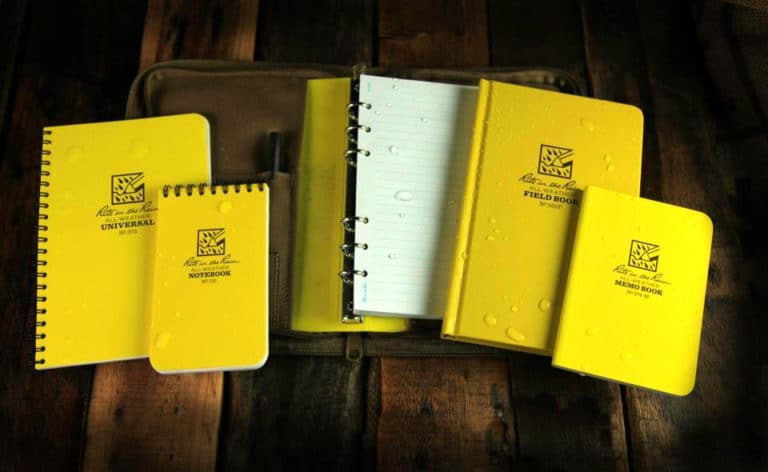
At what (x,y) coordinates should I click in order to perform the action: click on binder rings. Please return your answer as a coordinate pair (x, y). The image size is (768, 472). Looking at the image, I should click on (356, 151), (352, 128), (352, 105), (353, 217), (352, 245), (353, 270).